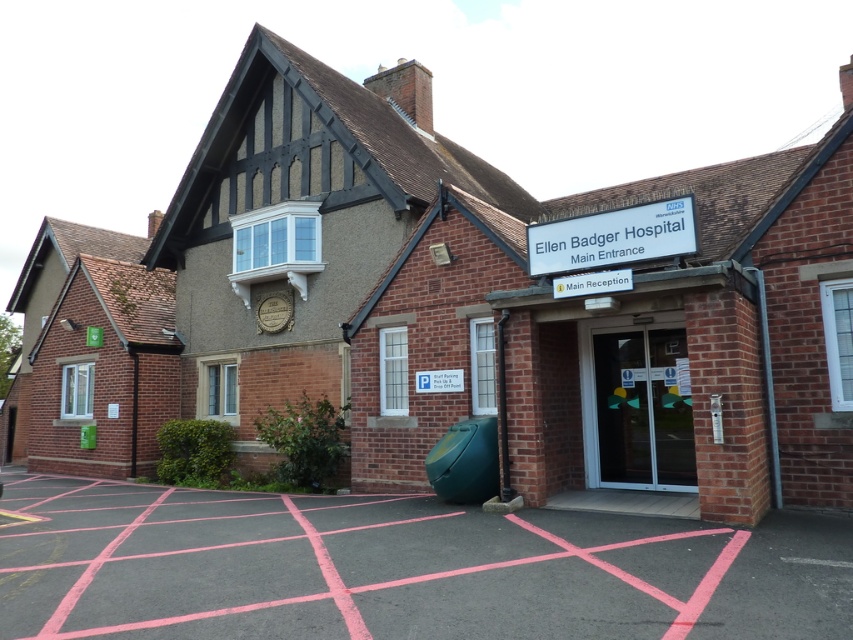
You are standing at the main entrance of Ellen Badger Hospital and need to find the pink asphalt parking lot at lower center. According to the hospital layout, where should you look relative to your current position?

The pink asphalt parking lot at lower center is located at point (398, 568), which would be to your lower center direction from the main entrance.

You are a person standing on the pink asphalt parking lot at lower center looking towards the transparent glass doors at center. Which object is taller?

The transparent glass doors at center are taller than the pink asphalt parking lot at lower center.

You are a patient arriving at Ellen Badger Hospital and need to enter through the transparent glass doors at center. You are currently parked in the pink asphalt parking lot at lower center. To reach the doors, should you walk to your left or right?

Since the pink asphalt parking lot at lower center is to the left of transparent glass doors at center, you should walk to your right to reach the doors.